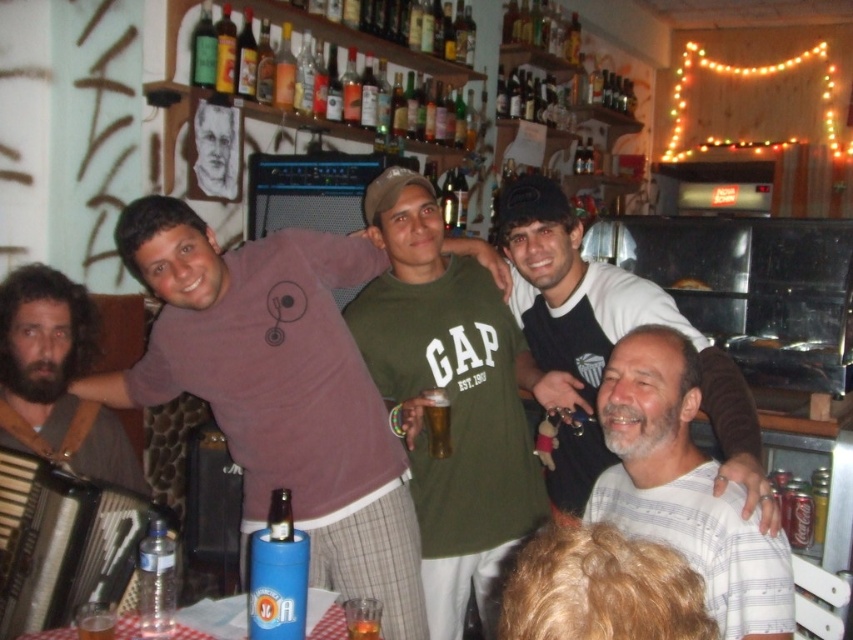
Question: Which point is farther to the camera?

Choices:
 (A) (51, 593)
 (B) (277, 410)
 (C) (405, 220)

Answer: (C)

Question: Can you confirm if green cotton shirt at center is positioned above translucent glass beer at lower left?

Choices:
 (A) no
 (B) yes

Answer: (B)

Question: Does black cotton shirt at center appear over green glass bottle at upper center?

Choices:
 (A) yes
 (B) no

Answer: (B)

Question: Which is farther from the translucent glass beer at lower left?

Choices:
 (A) green glass bottle at upper center
 (B) matte purple shirt at center
 (C) translucent glass bottle at upper center

Answer: (C)

Question: Can you confirm if black cotton shirt at center is positioned above translucent glass beer at lower left?

Choices:
 (A) no
 (B) yes

Answer: (B)

Question: Which point is farther from the camera taking this photo?

Choices:
 (A) (608, 272)
 (B) (155, 196)
 (C) (422, 426)
 (D) (196, 72)

Answer: (D)